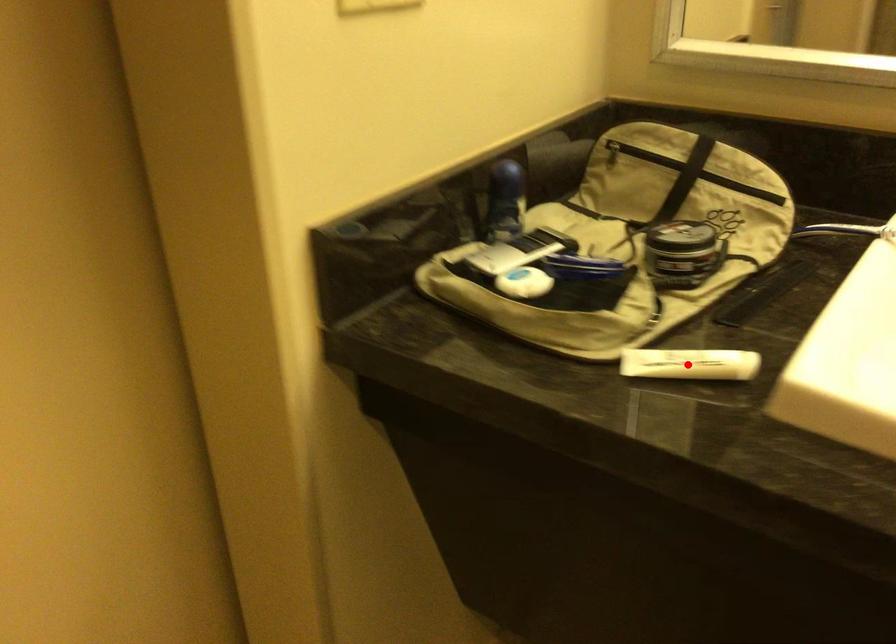
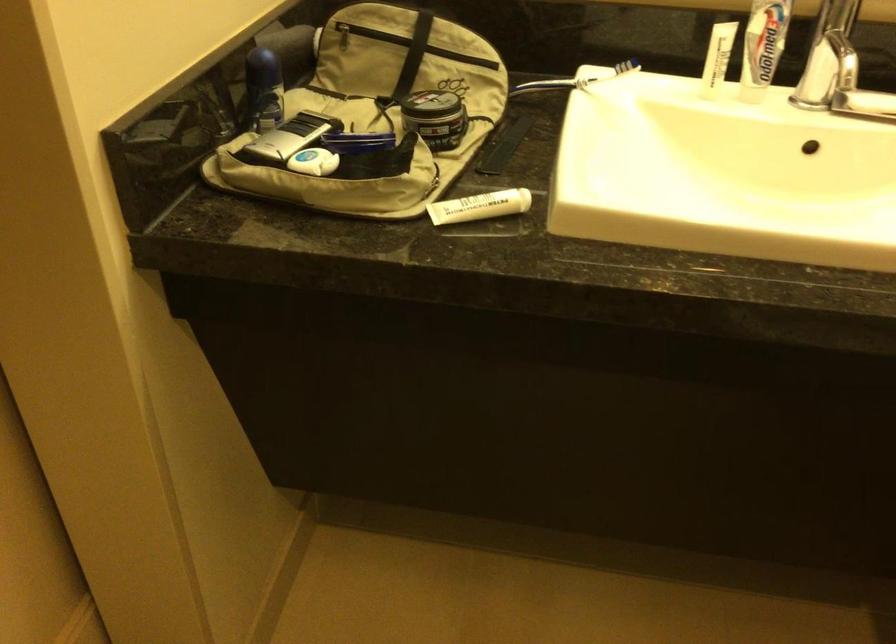
Where in the second image is the point corresponding to the highlighted location from the first image?

(479, 205)